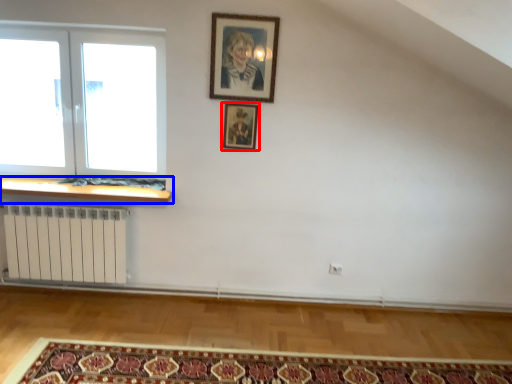
Question: Among these objects, which one is farthest to the camera, picture frame (highlighted by a red box) or window sill (highlighted by a blue box)?

Choices:
 (A) picture frame
 (B) window sill

Answer: (B)